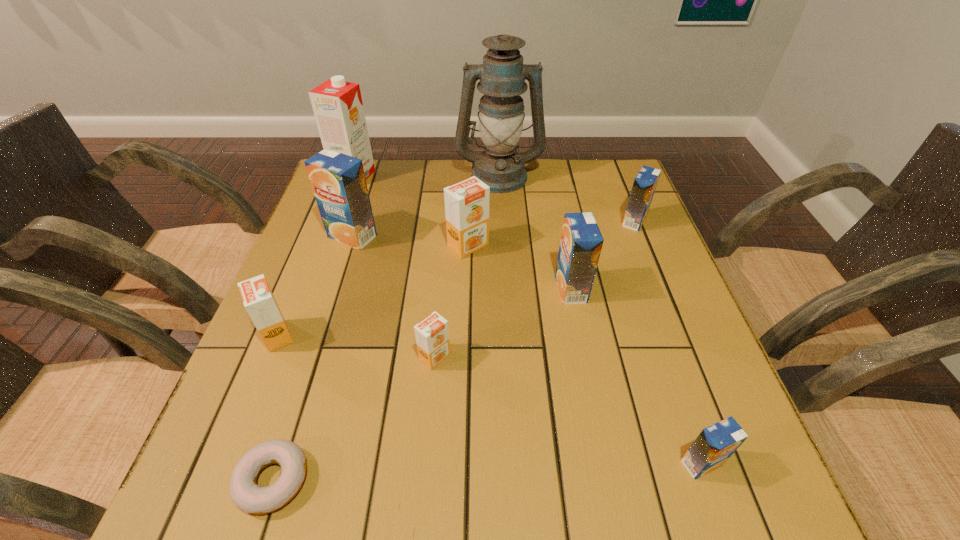
At what (x,y) coordinates should I click in order to perform the action: click on free location that satisfies the following two spatial constraints: 1. on the back side of the brown doughnut; 2. on the right side of the smallest orange orange juice. Please return your answer as a coordinate pair (x, y). Looking at the image, I should click on (313, 357).